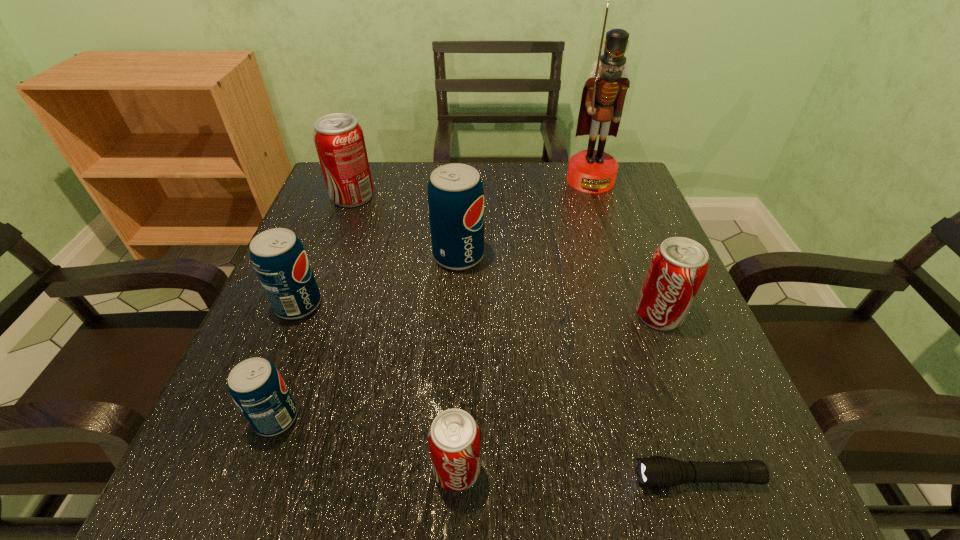
Identify the location of vacant region that satisfies the following two spatial constraints: 1. on the back side of the second biggest blue pop; 2. on the left side of the farthest soda can. (342, 197).